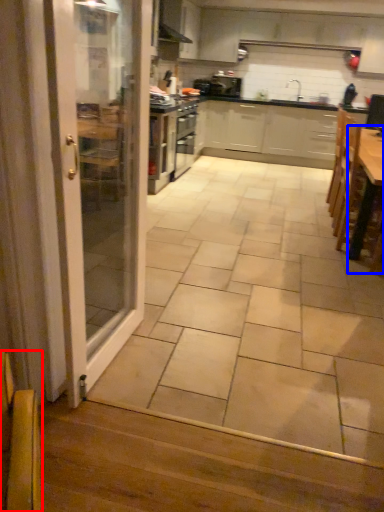
Question: Which of the following is the farthest to the observer, armchair (highlighted by a red box) or table (highlighted by a blue box)?

Choices:
 (A) armchair
 (B) table

Answer: (B)